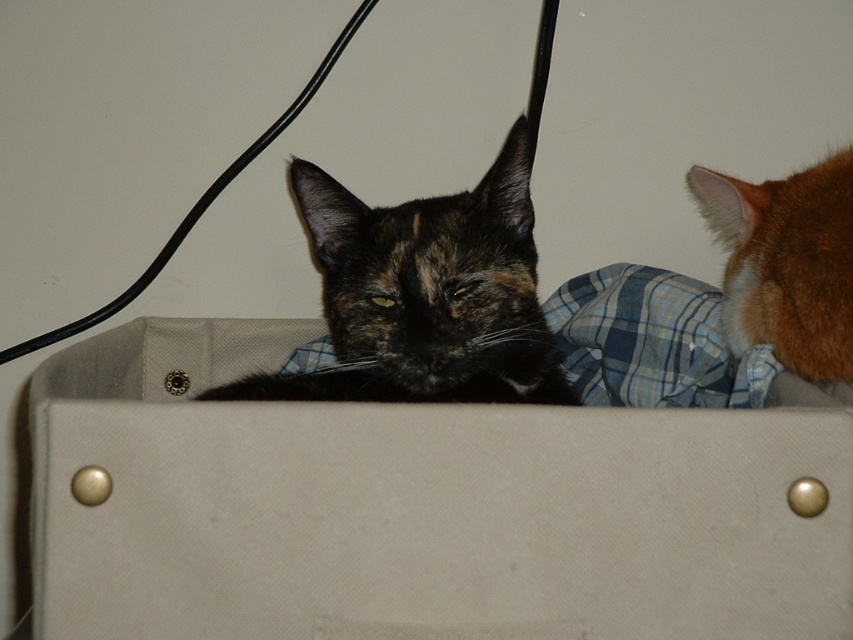
You are a photographer trying to capture the cat in the box. You notice two points marked on the image at coordinates point (532, 282) and point (831, 275). Which point is closer to your camera lens?

Point (532, 282) is further to the camera than point (831, 275), so the point closer to the camera lens is point (831, 275).

You are a delivery person who just arrived at a house and need to place a package in a safe spot away from the tortoiseshell fur cat at center. The package must be placed at point coordinates either at point A or point B. Point A is at coordinates point A is at point B is at point C. Wait, the problem says point A or B, but the objects description only mentions point (424, 294). Hmm, maybe I need to recheck the input. Let me see. The user provided the objects as point coordinates. The objects description.

The package should be placed at point B because point A is occupied by the tortoiseshell fur cat at center.